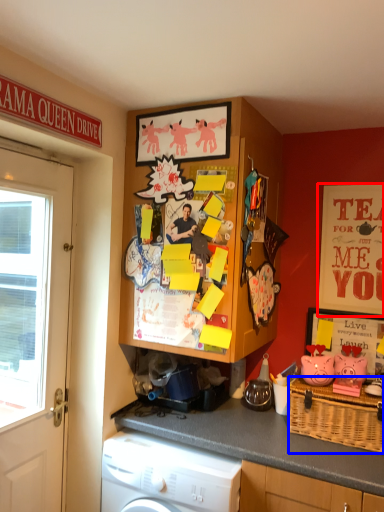
Question: Which of the following is the closest to the observer, advertisement (highlighted by a red box) or picnic basket (highlighted by a blue box)?

Choices:
 (A) advertisement
 (B) picnic basket

Answer: (B)